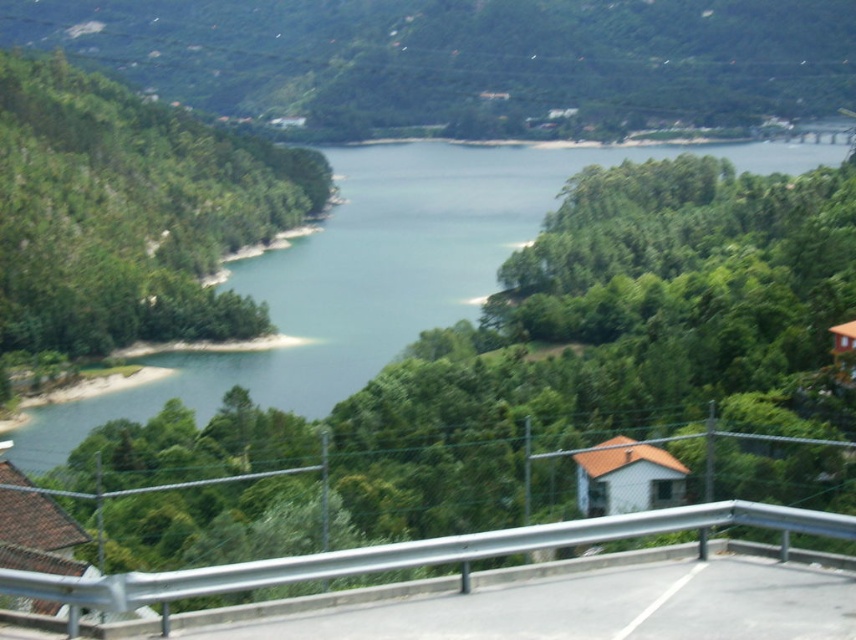
Is green water at center behind silver metallic guardrail at center?

That is True.

Is green water at center closer to the viewer compared to silver metallic guardrail at center?

No.

Where is `green water at center`? green water at center is located at coordinates (373, 275).

The image size is (856, 640). What are the coordinates of `green water at center` in the screenshot? It's located at (373, 275).